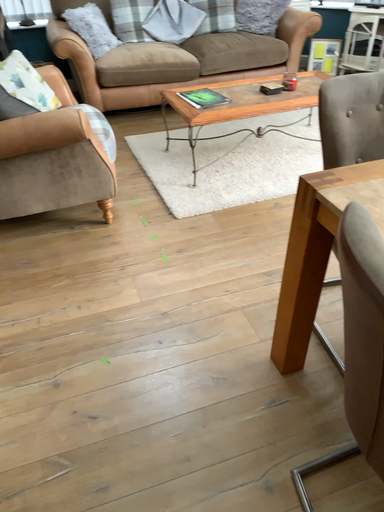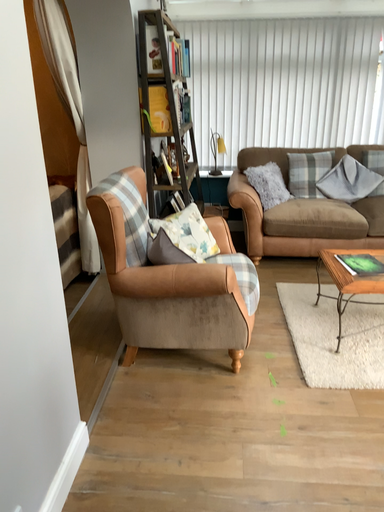
Question: How did the camera likely rotate when shooting the video?

Choices:
 (A) rotated downward
 (B) rotated upward

Answer: (B)